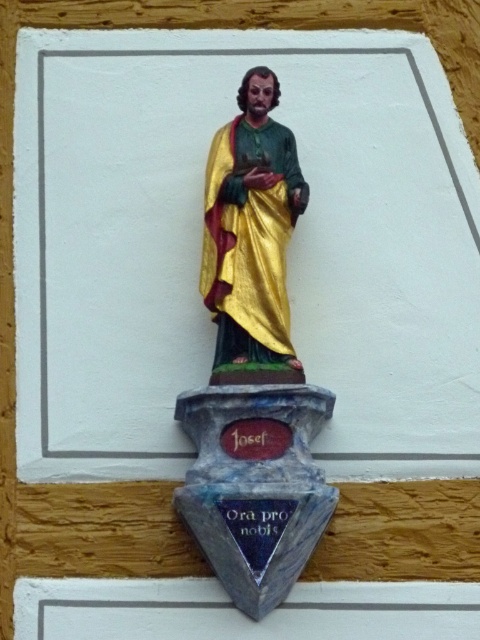
Who is more forward, [303,480] or [207,237]?

Point [303,480] is more forward.

The height and width of the screenshot is (640, 480). In order to click on gold painted statue at center in this screenshot , I will do `click(253, 369)`.